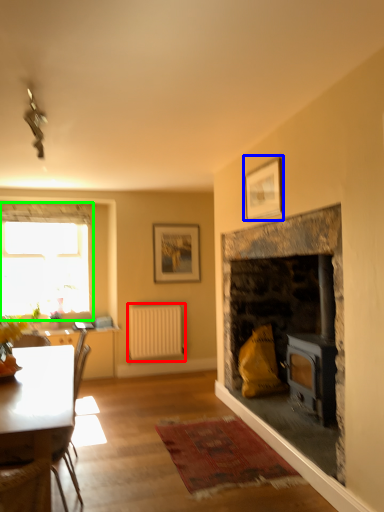
Question: Considering the real-world distances, which object is farthest from radiator (highlighted by a red box)? picture frame (highlighted by a blue box) or window (highlighted by a green box)?

Choices:
 (A) picture frame
 (B) window

Answer: (A)